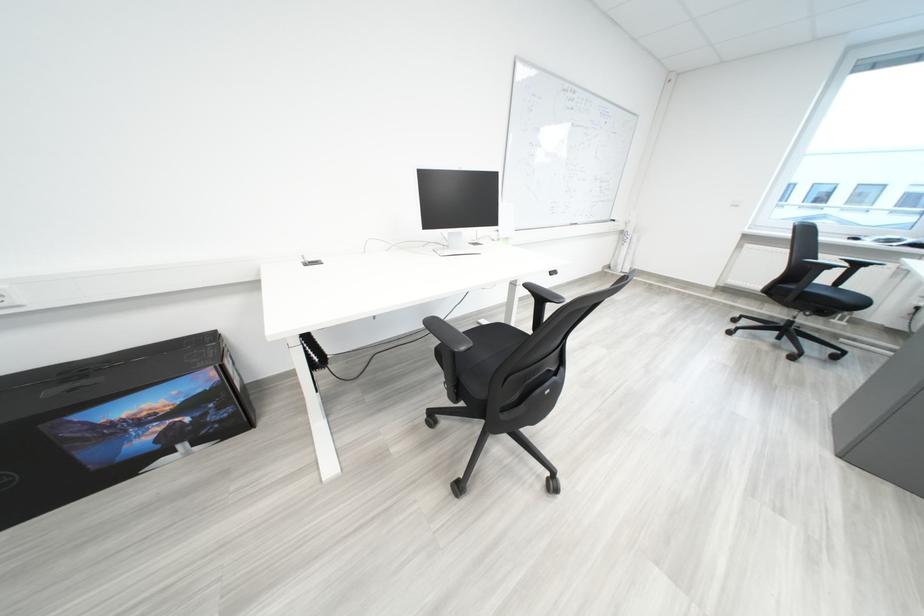
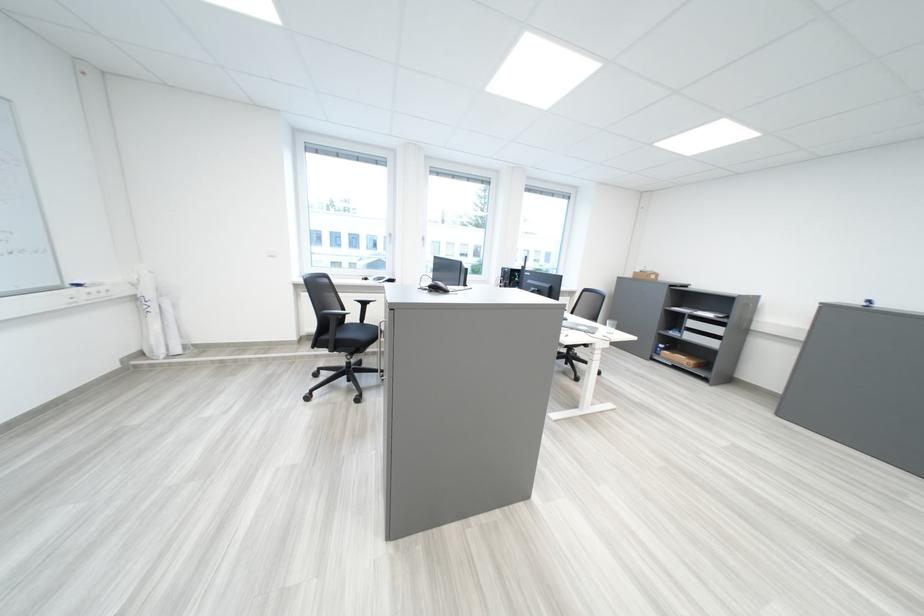
The point at (x=804, y=292) is marked in the first image. Where is the corresponding point in the second image?

(341, 342)